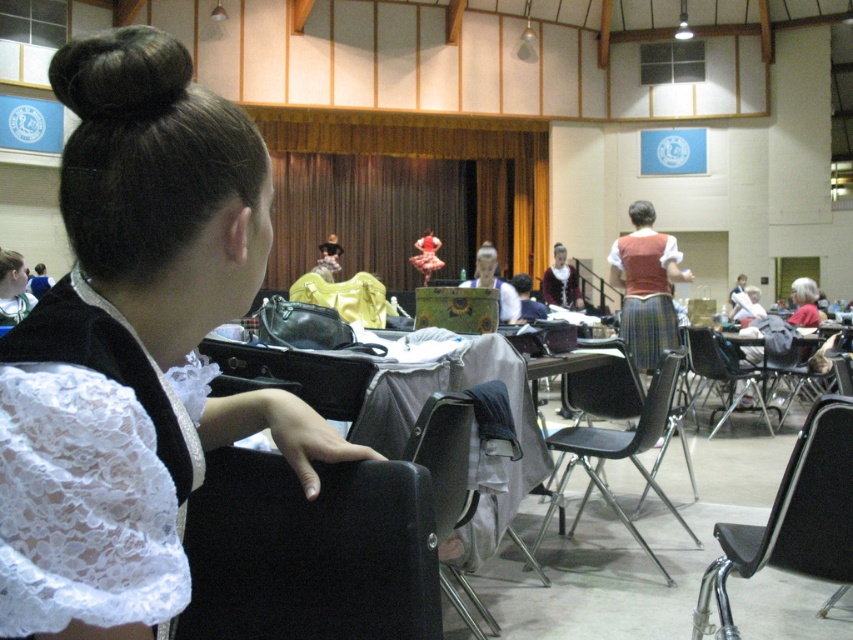
Question: In this image, where is black plastic chair at center located relative to black plastic chair at lower right?

Choices:
 (A) right
 (B) left

Answer: (B)

Question: Can you confirm if white lace dress at center is smaller than plaid skirt at center?

Choices:
 (A) yes
 (B) no

Answer: (A)

Question: Which point appears closest to the camera in this image?

Choices:
 (A) (746, 570)
 (B) (630, 211)

Answer: (A)

Question: Which object is closer to the camera taking this photo?

Choices:
 (A) black plastic chair at lower right
 (B) black fabric chair at lower right
 (C) white lace dress at center
 (D) green textured box at center

Answer: (C)

Question: Does black plastic chair at center have a smaller size compared to black plastic chair at lower right?

Choices:
 (A) no
 (B) yes

Answer: (B)

Question: Which object appears closest to the camera in this image?

Choices:
 (A) black leather chair at lower center
 (B) black plastic chair at lower right

Answer: (A)